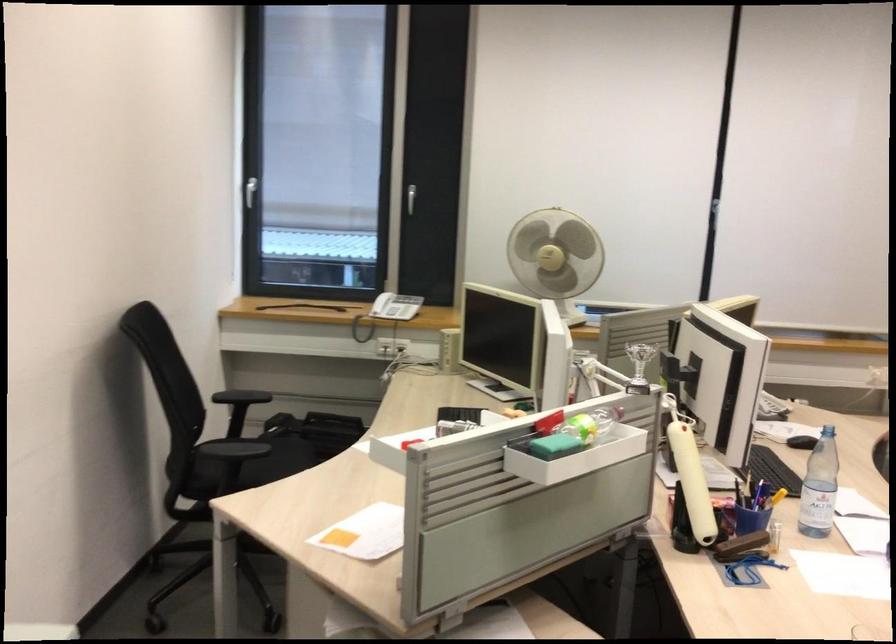
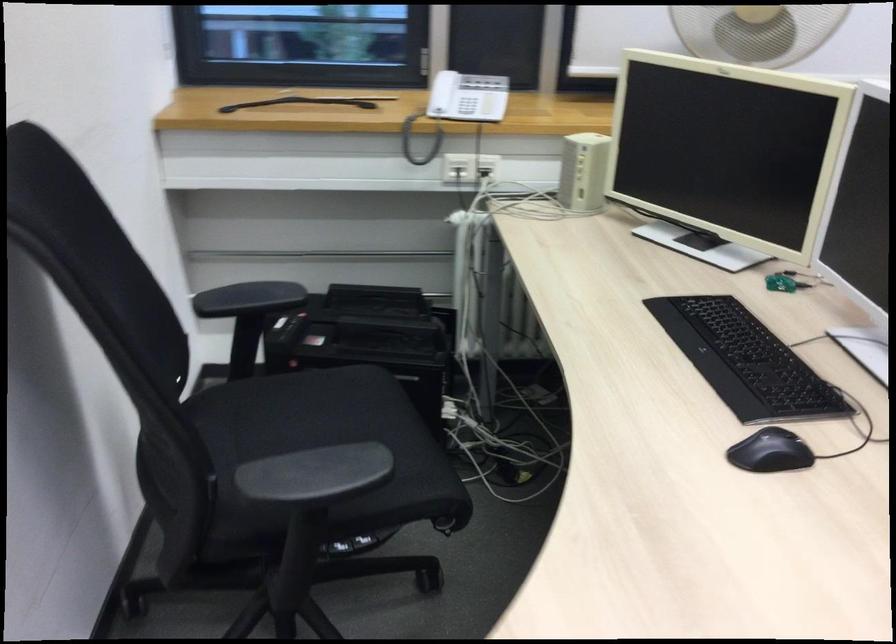
In the second image, find the point that corresponds to pixel 228 453 in the first image.

(315, 475)